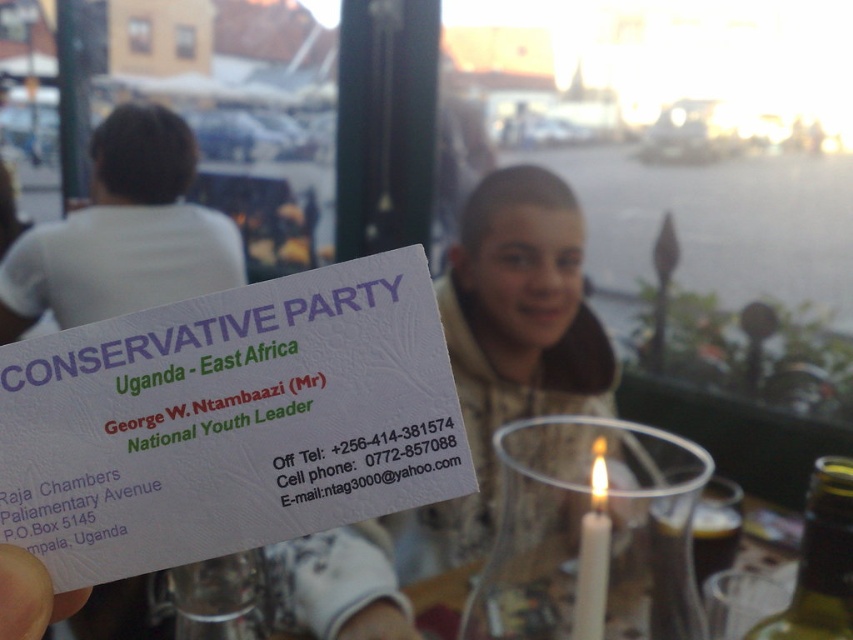
Question: Estimate the real-world distances between objects in this image. Which object is closer to the white paper business card at lower left?

Choices:
 (A) white wax candle at lower right
 (B) translucent glass candle at center

Answer: (A)

Question: Considering the relative positions of smooth beige hoodie at center and translucent glass candle at center in the image provided, where is smooth beige hoodie at center located with respect to translucent glass candle at center?

Choices:
 (A) left
 (B) right

Answer: (A)

Question: Which is farther from the white paper business card at lower left?

Choices:
 (A) translucent glass candle at center
 (B) smooth beige hoodie at center
 (C) white wax candle at lower right
 (D) white textured business card at center

Answer: (A)

Question: Is white textured business card at center thinner than smooth beige hoodie at center?

Choices:
 (A) no
 (B) yes

Answer: (B)

Question: Can you confirm if white paper business card at lower left is thinner than white wax candle at lower right?

Choices:
 (A) yes
 (B) no

Answer: (A)

Question: Which of these objects is positioned closest to the white textured business card at center?

Choices:
 (A) translucent glass candle at center
 (B) white wax candle at lower right
 (C) smooth beige hoodie at center

Answer: (B)